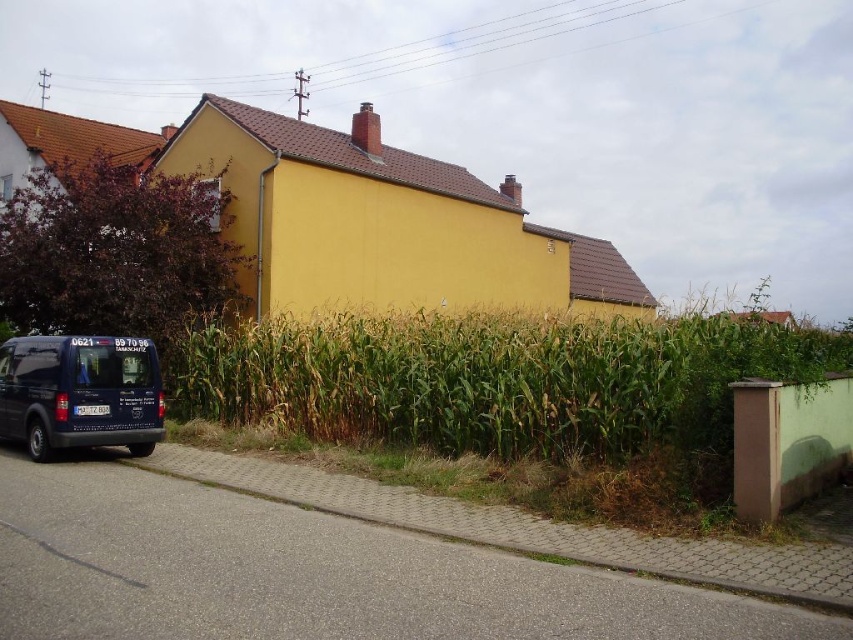
Is green leafy corn at center wider than matte black van at lower left?

Indeed, green leafy corn at center has a greater width compared to matte black van at lower left.

Which is above, green leafy corn at center or matte black van at lower left?

green leafy corn at center

Which is in front, point (468, 358) or point (96, 436)?

Point (96, 436) is more forward.

This screenshot has width=853, height=640. I want to click on green leafy corn at center, so click(495, 380).

The width and height of the screenshot is (853, 640). In order to click on gray concrete curb at lower left in this screenshot , I will do `click(527, 529)`.

From the picture: Who is more distant from viewer, (608, 557) or (149, 380)?

The point (149, 380) is more distant.

Does point (840, 604) come in front of point (57, 369)?

Yes, point (840, 604) is closer to viewer.

This screenshot has width=853, height=640. I want to click on gray concrete curb at lower left, so click(x=527, y=529).

Does green leafy corn at center have a smaller size compared to gray concrete curb at lower left?

No.

Who is lower down, green leafy corn at center or gray concrete curb at lower left?

gray concrete curb at lower left is lower down.

The width and height of the screenshot is (853, 640). What do you see at coordinates (495, 380) in the screenshot? I see `green leafy corn at center` at bounding box center [495, 380].

Where is `green leafy corn at center`? The image size is (853, 640). green leafy corn at center is located at coordinates (495, 380).